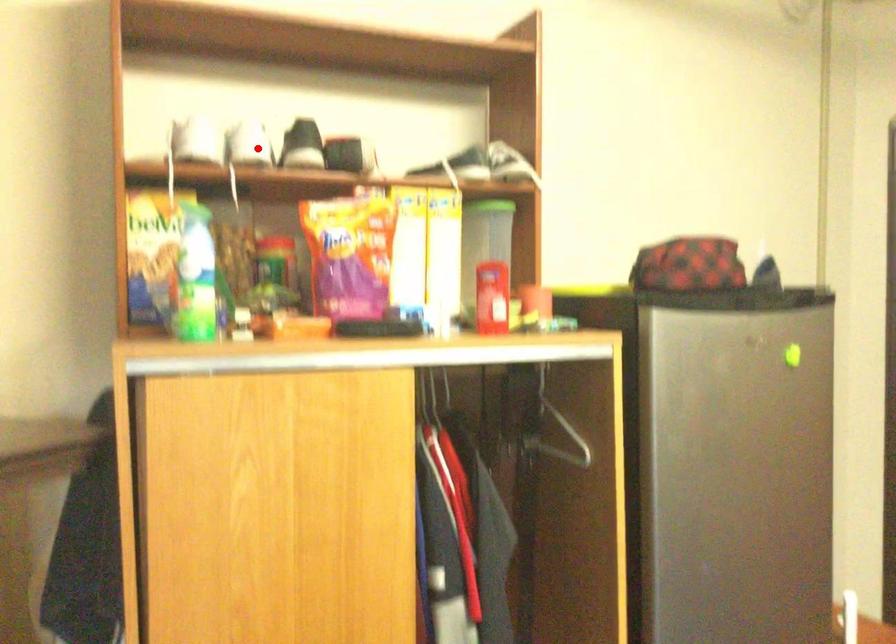
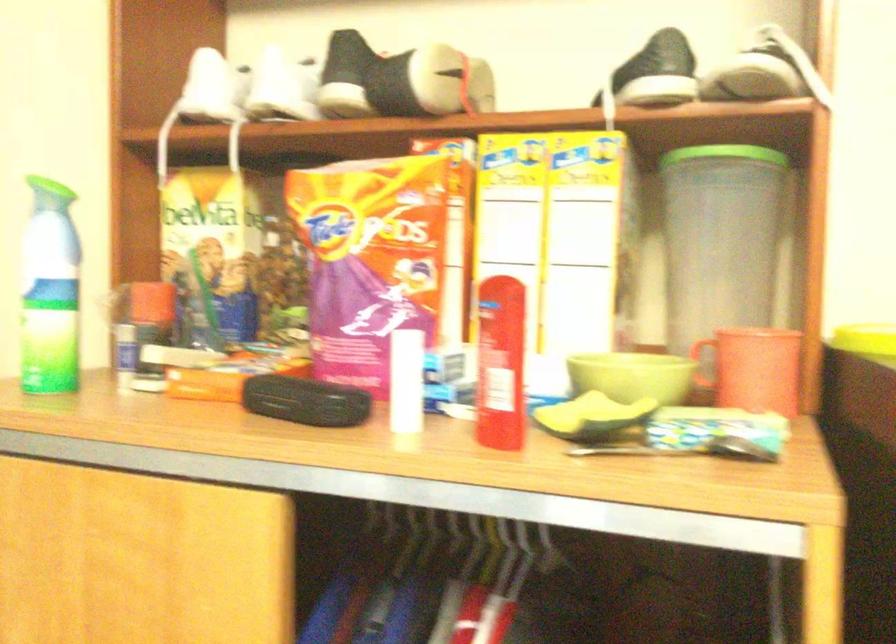
Question: A red point is marked in image1. In image2, is the corresponding 3D point closer to the camera or farther? Reply with the corresponding letter.

Choices:
 (A) The corresponding 3D point is closer.
 (B) The corresponding 3D point is farther.

Answer: (A)